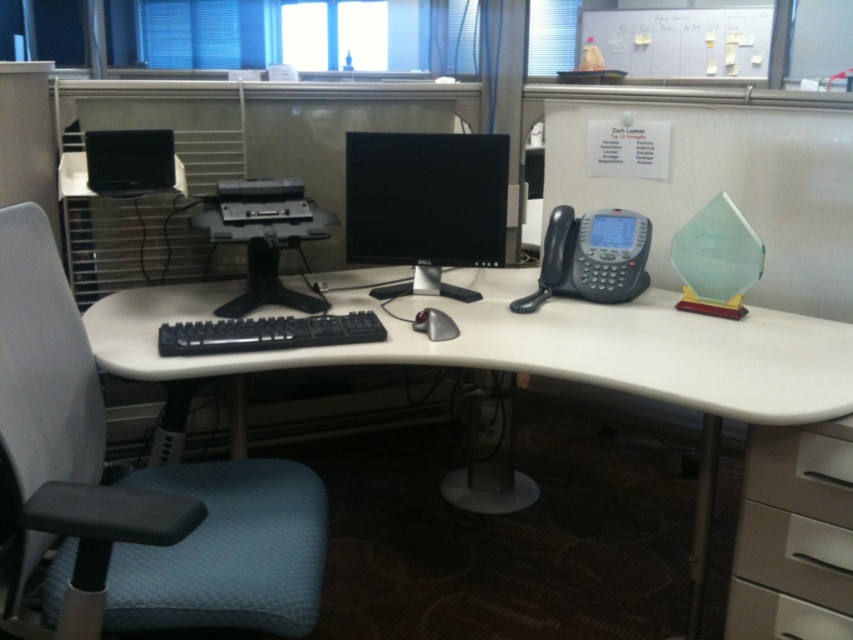
You are sitting in the blue fabric swivel chair at left and want to reach the silver metallic mouse at center. Can you move your hand directly forward to grab it without moving your body?

The blue fabric swivel chair at left is below the silver metallic mouse at center, so moving your hand directly forward would not reach it since the mouse is above you. You need to move your hand upward.

From the picture: You are an office worker who needs to choose between sitting on the blue fabric swivel chair at left or using the silver metallic mouse at center. Which object is bigger in size?

The blue fabric swivel chair at left is larger in size compared to the silver metallic mouse at center.

You are organizing a desk and need to place a new item between the black glossy monitor at center and the silver metallic mouse at center. Which object should you place the item closer to if you want it to be near the larger object?

The black glossy monitor at center is bigger than the silver metallic mouse at center, so you should place the item closer to the black glossy monitor at center.